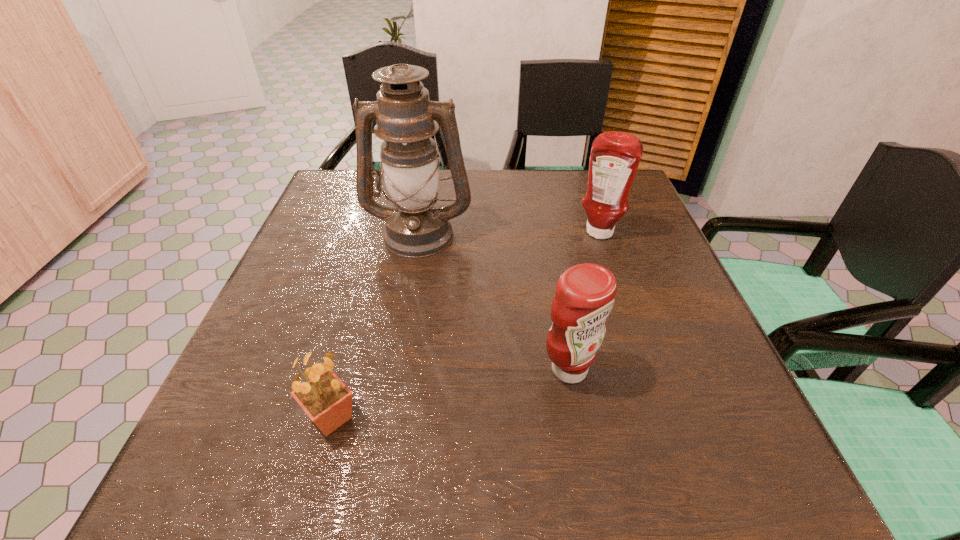
Where is `vacant region located 0.260m at the front of the nearest object with flowers visible`? vacant region located 0.260m at the front of the nearest object with flowers visible is located at coordinates (521, 417).

Locate an element on the screen. The height and width of the screenshot is (540, 960). object that is positioned at the far edge is located at coordinates (416, 226).

I want to click on object that is at the near edge, so click(327, 401).

Where is `oil lamp that is at the left edge`? Image resolution: width=960 pixels, height=540 pixels. oil lamp that is at the left edge is located at coordinates (416, 226).

Image resolution: width=960 pixels, height=540 pixels. Identify the location of sunflower that is at the left edge. 327,401.

Locate an element on the screen. The image size is (960, 540). object situated at the right edge is located at coordinates (615, 156).

I want to click on object that is at the far left corner, so click(x=416, y=226).

You are a GUI agent. You are given a task and a screenshot of the screen. Output one action in this format:
    pyautogui.click(x=<x>, y=<y>)
    Task: Click on the object that is positioned at the near left corner
    
    Given the screenshot: What is the action you would take?
    pyautogui.click(x=327, y=401)

You are a GUI agent. You are given a task and a screenshot of the screen. Output one action in this format:
    pyautogui.click(x=<x>, y=<y>)
    Task: Click on the free space at the far edge of the desktop
    Image resolution: width=960 pixels, height=540 pixels.
    Given the screenshot: What is the action you would take?
    pyautogui.click(x=541, y=170)

The width and height of the screenshot is (960, 540). In order to click on vacant space at the near edge of the desktop in this screenshot , I will do `click(493, 456)`.